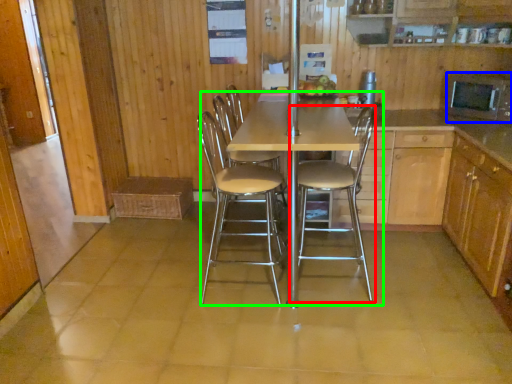
Question: Which object is positioned closest to chair (highlighted by a red box)? Select from appliance (highlighted by a blue box) and kitchen & dining room table (highlighted by a green box).

Choices:
 (A) appliance
 (B) kitchen & dining room table

Answer: (B)